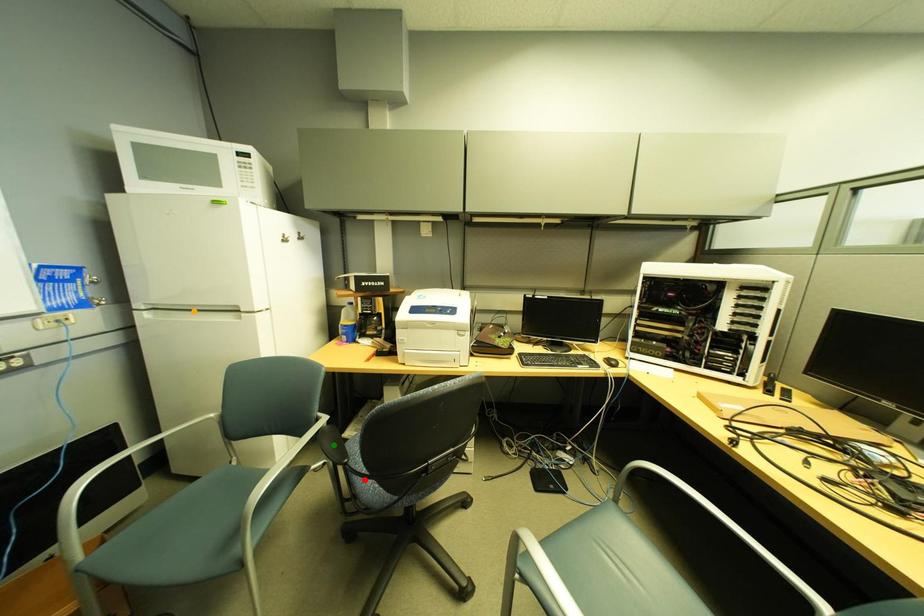
Based on the photo, order these from farthest to nearest:
green point | red point | orange point

green point < orange point < red point